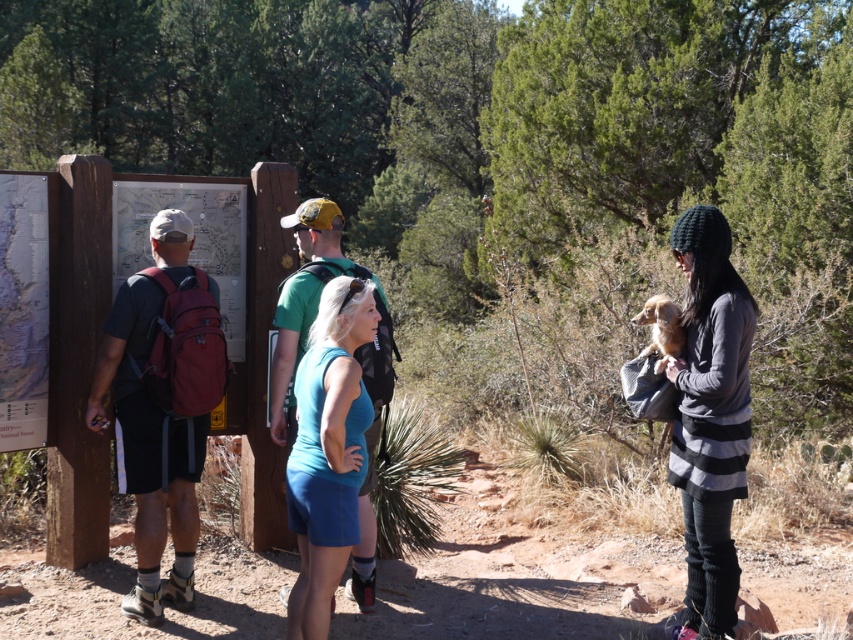
Is matte red backpack at left below knitted gray sweater at right?

Incorrect, matte red backpack at left is not positioned below knitted gray sweater at right.

Who is shorter, matte red backpack at left or knitted gray sweater at right?

With less height is knitted gray sweater at right.

Is point (173, 316) behind point (715, 628)?

That is True.

At what (x,y) coordinates should I click in order to perform the action: click on matte red backpack at left. Please return your answer as a coordinate pair (x, y). Image resolution: width=853 pixels, height=640 pixels. Looking at the image, I should click on (161, 404).

Who is positioned more to the left, knitted gray sweater at right or blue fabric tank top at center?

blue fabric tank top at center is more to the left.

Is knitted gray sweater at right taller than blue fabric tank top at center?

Yes, knitted gray sweater at right is taller than blue fabric tank top at center.

Does point (709, 586) come farther from viewer compared to point (334, 404)?

Yes, point (709, 586) is farther from viewer.

The image size is (853, 640). I want to click on knitted gray sweater at right, so click(x=711, y=417).

Which is behind, point (199, 381) or point (352, 328)?

The point (199, 381) is behind.

Is point (184, 230) closer to viewer compared to point (340, 513)?

That is False.

Identify the location of matte red backpack at left. This screenshot has height=640, width=853. (161, 404).